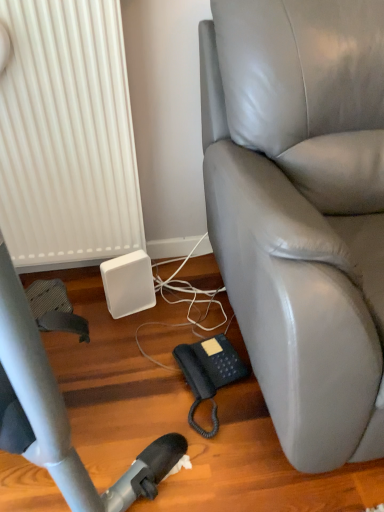
Where is `vacant area that lies to the right of white matte speaker at lower left`? This screenshot has height=512, width=384. vacant area that lies to the right of white matte speaker at lower left is located at coordinates (178, 309).